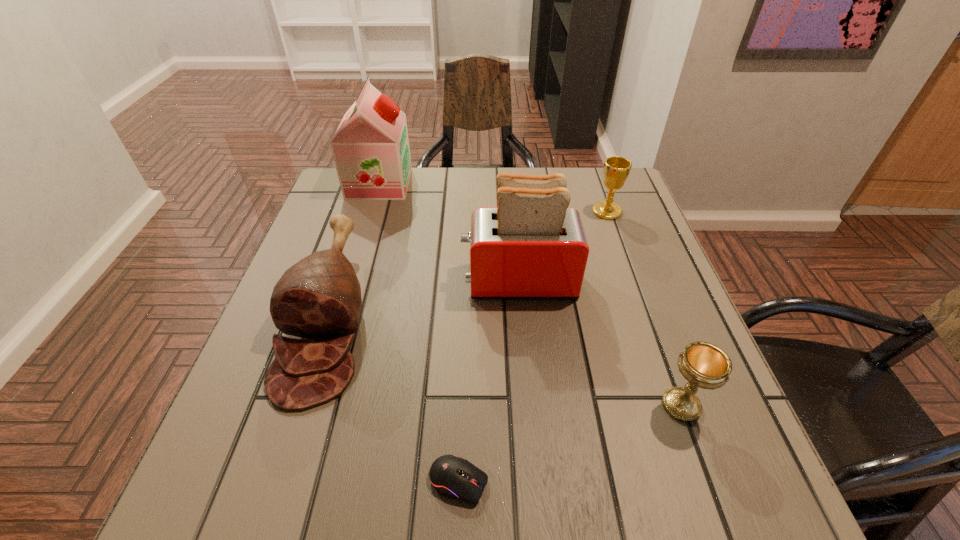
You are a GUI agent. You are given a task and a screenshot of the screen. Output one action in this format:
    pyautogui.click(x=<x>, y=<y>)
    Task: Click on the vacant space situated 0.120m on the front-facing side of the toaster
    This screenshot has width=960, height=540.
    Given the screenshot: What is the action you would take?
    pyautogui.click(x=409, y=281)

Find the location of a particular element. vacant region located at the sliced end of the ham is located at coordinates tap(275, 483).

In order to click on blank space located 0.130m on the front of the farther chalice in this screenshot , I will do `click(621, 252)`.

Locate an element on the screen. The height and width of the screenshot is (540, 960). vacant space located 0.060m on the back of the nearer chalice is located at coordinates (664, 359).

Locate an element on the screen. free space located on the left of the shortest object is located at coordinates (351, 482).

At what (x,y) coordinates should I click in order to perform the action: click on soya milk present at the far edge. Please return your answer as a coordinate pair (x, y). Looking at the image, I should click on (370, 147).

This screenshot has height=540, width=960. Find the location of `chalice that is at the far edge`. chalice that is at the far edge is located at coordinates (616, 169).

The image size is (960, 540). I want to click on object that is at the near edge, so click(453, 477).

You are a GUI agent. You are given a task and a screenshot of the screen. Output one action in this format:
    pyautogui.click(x=<x>, y=<y>)
    Task: Click on the soya milk that is positioned at the left edge
    This screenshot has width=960, height=540.
    Given the screenshot: What is the action you would take?
    pyautogui.click(x=370, y=147)

This screenshot has height=540, width=960. I want to click on ham that is positioned at the left edge, so click(319, 297).